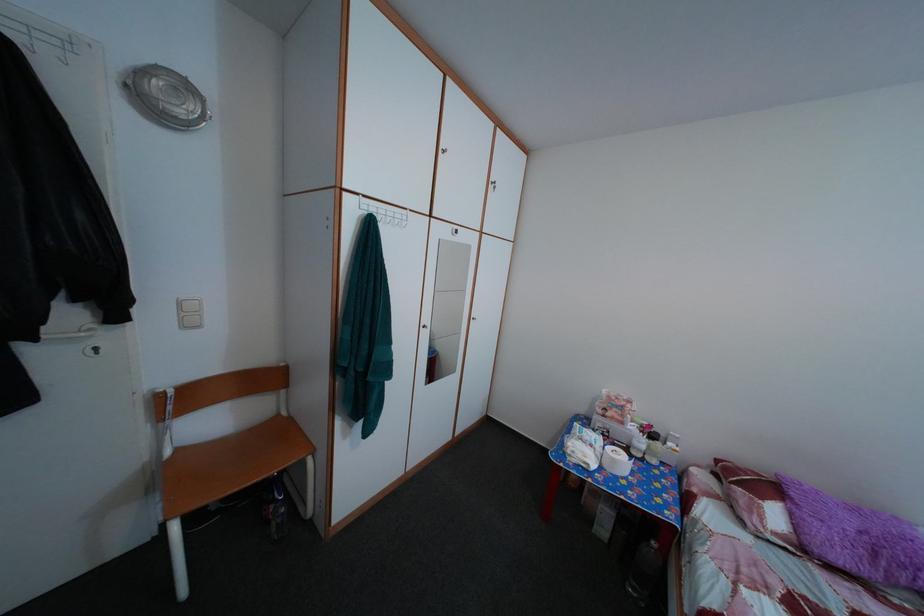
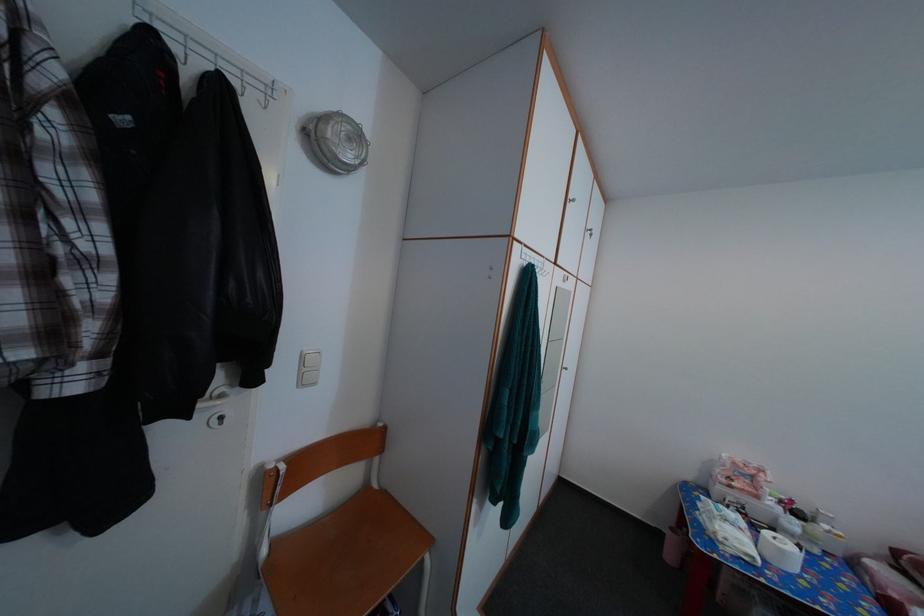
Find the pixel in the second image that matches point 354,201 in the first image.

(525, 251)